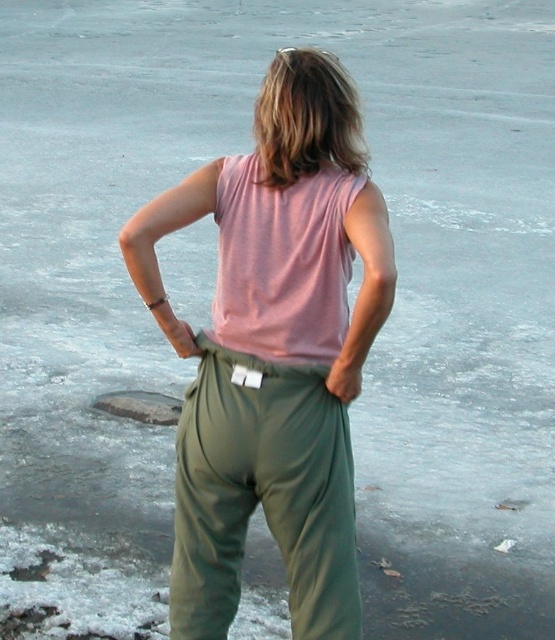
Question: Is matte pink tank top at center further to the viewer compared to olive green fabric pants at center?

Choices:
 (A) yes
 (B) no

Answer: (B)

Question: Which object is farther from the camera taking this photo?

Choices:
 (A) matte pink tank top at center
 (B) olive green fabric pants at center

Answer: (B)

Question: Does matte pink tank top at center appear on the right side of olive green fabric pants at center?

Choices:
 (A) no
 (B) yes

Answer: (A)

Question: Is matte pink tank top at center to the right of olive green fabric pants at center from the viewer's perspective?

Choices:
 (A) yes
 (B) no

Answer: (B)

Question: Which point appears farthest from the camera in this image?

Choices:
 (A) (201, 609)
 (B) (355, 148)

Answer: (A)